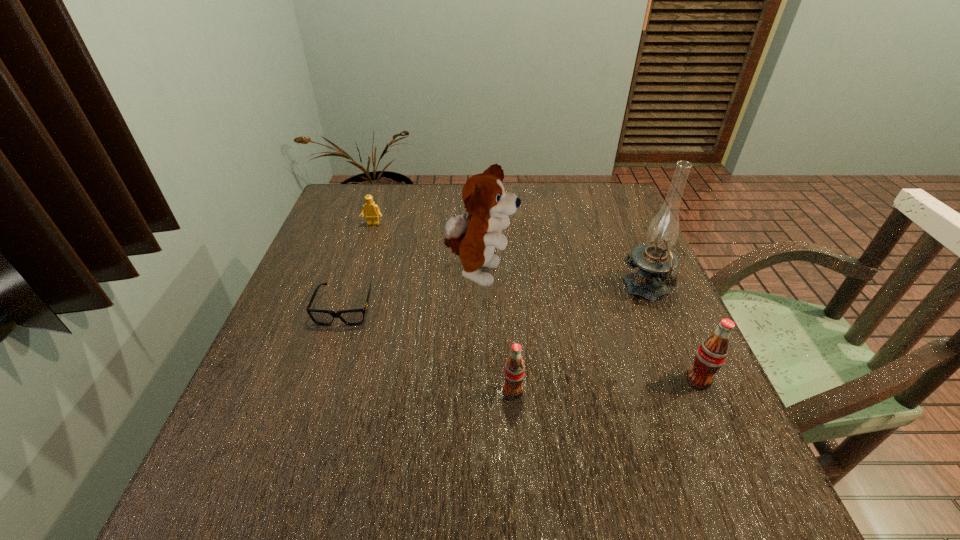
Locate an element on the screen. The width and height of the screenshot is (960, 540). free space between the shortest object and the Lego is located at coordinates (359, 266).

Identify the location of free space that is in between the fourth tallest object and the taller soda. This screenshot has height=540, width=960. (606, 386).

Find the location of a particular element. This screenshot has height=540, width=960. blank region between the oil lamp and the left soda is located at coordinates (580, 341).

Where is `empty location between the puppy and the oil lamp`? empty location between the puppy and the oil lamp is located at coordinates (564, 282).

Identify the location of vacant space that is in between the fourth shortest object and the second tallest object. (588, 327).

You are a GUI agent. You are given a task and a screenshot of the screen. Output one action in this format:
    pyautogui.click(x=<x>, y=<y>)
    Task: Click on the unoccupied area between the second tallest object and the oil lamp
    The height and width of the screenshot is (540, 960).
    Given the screenshot: What is the action you would take?
    pyautogui.click(x=564, y=282)

At what (x,y) coordinates should I click in order to perform the action: click on object identified as the fourth closest to the left soda. Please return your answer as a coordinate pair (x, y). Image resolution: width=960 pixels, height=540 pixels. Looking at the image, I should click on (657, 263).

I want to click on object identified as the second closest to the second shortest object, so click(x=352, y=317).

Where is `free space that satisfies the following two spatial constraints: 1. on the back side of the fourth shortest object; 2. on the face of the second tallest object`? free space that satisfies the following two spatial constraints: 1. on the back side of the fourth shortest object; 2. on the face of the second tallest object is located at coordinates (651, 274).

This screenshot has height=540, width=960. In order to click on free space that satisfies the following two spatial constraints: 1. on the back side of the fourth shortest object; 2. on the face of the second tallest object in this screenshot , I will do `click(651, 274)`.